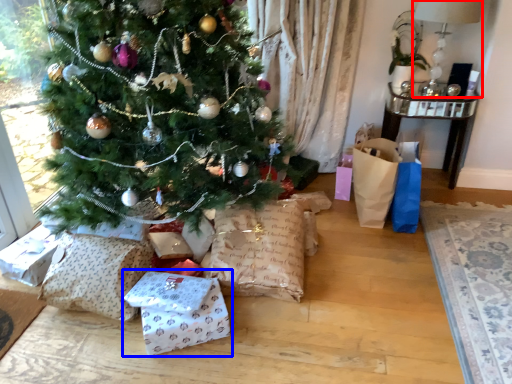
Question: Among these objects, which one is farthest to the camera, lamp (highlighted by a red box) or gift wrap (highlighted by a blue box)?

Choices:
 (A) lamp
 (B) gift wrap

Answer: (A)